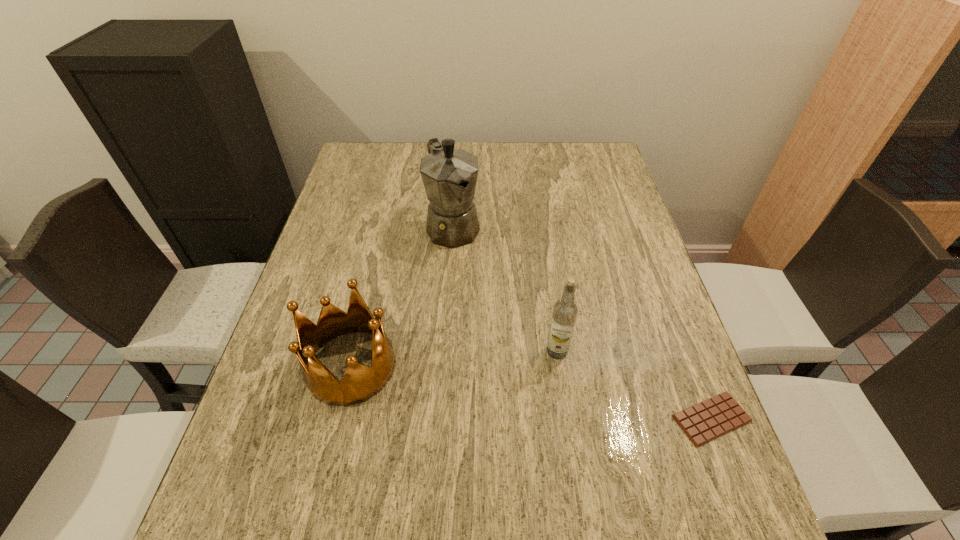
The image size is (960, 540). Find the location of `vacant area that lies between the rightmost object and the third tallest object`. vacant area that lies between the rightmost object and the third tallest object is located at coordinates (531, 392).

You are a GUI agent. You are given a task and a screenshot of the screen. Output one action in this format:
    pyautogui.click(x=<x>, y=<y>)
    Task: Click on the vacant area between the leftmost object and the vodka
    This screenshot has width=960, height=540.
    Given the screenshot: What is the action you would take?
    [x=454, y=359]

This screenshot has height=540, width=960. What are the coordinates of `vacant point located between the vodka and the shortest object` in the screenshot? It's located at (635, 385).

Find the location of a particular element. The image size is (960, 540). vacant space in between the crown and the third object from right to left is located at coordinates (402, 296).

Find the location of a particular element. The width and height of the screenshot is (960, 540). vacant area that lies between the coffeepot and the second tallest object is located at coordinates (505, 289).

Where is `vacant region between the shortest object and the third shortest object`? This screenshot has height=540, width=960. vacant region between the shortest object and the third shortest object is located at coordinates (635, 385).

Where is `object that stands as the second closest to the coffeepot`? The width and height of the screenshot is (960, 540). object that stands as the second closest to the coffeepot is located at coordinates (565, 311).

Identify the location of the closest object relative to the tallest object. (359, 383).

In order to click on vacant space that satisfies the following two spatial constraints: 1. on the front side of the vodka; 2. on the right side of the rightmost object in this screenshot , I will do `click(566, 418)`.

Where is `free location that satisfies the following two spatial constraints: 1. on the back side of the leftmost object; 2. on the left side of the farthest object`? The height and width of the screenshot is (540, 960). free location that satisfies the following two spatial constraints: 1. on the back side of the leftmost object; 2. on the left side of the farthest object is located at coordinates (384, 227).